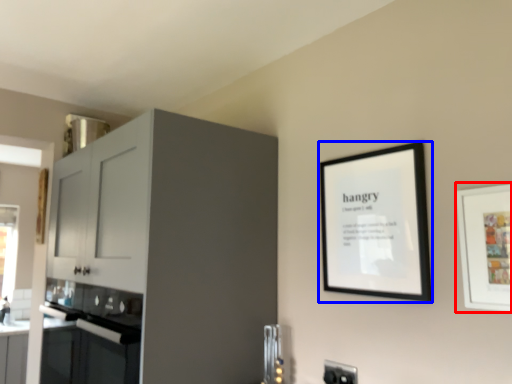
Question: Which of the following is the farthest to the observer, picture frame (highlighted by a red box) or picture frame (highlighted by a blue box)?

Choices:
 (A) picture frame
 (B) picture frame

Answer: (B)